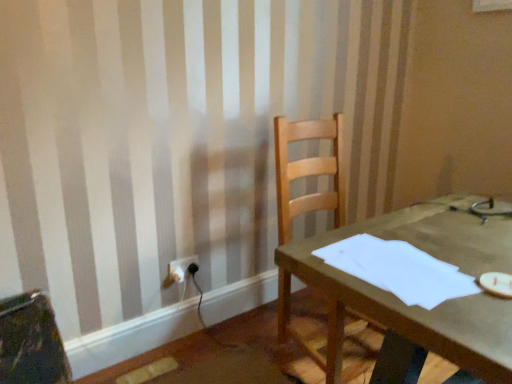
Question: Would you say wooden chair at center is a long distance from white paper at center?

Choices:
 (A) no
 (B) yes

Answer: (A)

Question: Is wooden chair at center positioned beyond the bounds of white paper at center?

Choices:
 (A) no
 (B) yes

Answer: (B)

Question: Is wooden chair at center touching white paper at center?

Choices:
 (A) no
 (B) yes

Answer: (A)

Question: From a real-world perspective, is wooden chair at center positioned under white paper at center based on gravity?

Choices:
 (A) no
 (B) yes

Answer: (B)

Question: Does wooden chair at center lie behind white paper at center?

Choices:
 (A) yes
 (B) no

Answer: (A)

Question: Is white paper at center wider or thinner than wooden chair at center?

Choices:
 (A) thin
 (B) wide

Answer: (A)

Question: Considering the positions of white paper at center and wooden chair at center in the image, is white paper at center bigger or smaller than wooden chair at center?

Choices:
 (A) big
 (B) small

Answer: (B)

Question: Is point (355, 248) positioned closer to the camera than point (337, 140)?

Choices:
 (A) farther
 (B) closer

Answer: (B)

Question: In the image, is white paper at center positioned in front of or behind wooden chair at center?

Choices:
 (A) behind
 (B) front

Answer: (B)

Question: Looking at their shapes, would you say white paper at center is wider or thinner than white plastic electric outlet at lower left?

Choices:
 (A) wide
 (B) thin

Answer: (A)

Question: From the image's perspective, is white paper at center above or below white plastic electric outlet at lower left?

Choices:
 (A) above
 (B) below

Answer: (A)

Question: Is white paper at center taller or shorter than white plastic electric outlet at lower left?

Choices:
 (A) short
 (B) tall

Answer: (A)

Question: Is point (355, 241) closer or farther from the camera than point (196, 261)?

Choices:
 (A) farther
 (B) closer

Answer: (B)

Question: From the image's perspective, relative to white plastic electric outlet at lower left, is wooden chair at center above or below?

Choices:
 (A) above
 (B) below

Answer: (A)

Question: Does point (336, 311) appear closer or farther from the camera than point (170, 271)?

Choices:
 (A) farther
 (B) closer

Answer: (B)